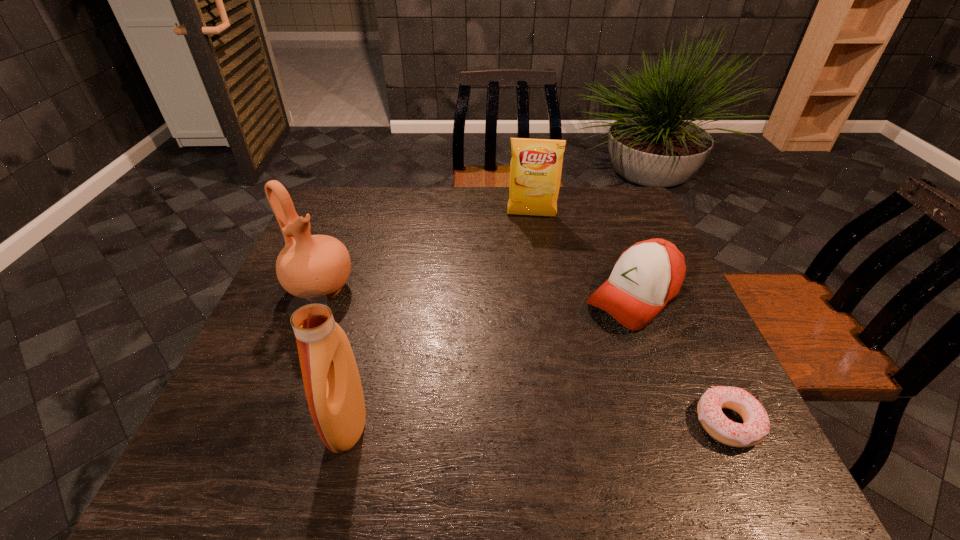
Locate an element on the screen. free spot that satisfies the following two spatial constraints: 1. on the front side of the shortest object; 2. on the right side of the crisp (potato chip) is located at coordinates (564, 423).

Where is `blank space that satisfies the following two spatial constraints: 1. on the back side of the farthest object; 2. on the left side of the leftmost object`? The height and width of the screenshot is (540, 960). blank space that satisfies the following two spatial constraints: 1. on the back side of the farthest object; 2. on the left side of the leftmost object is located at coordinates (350, 215).